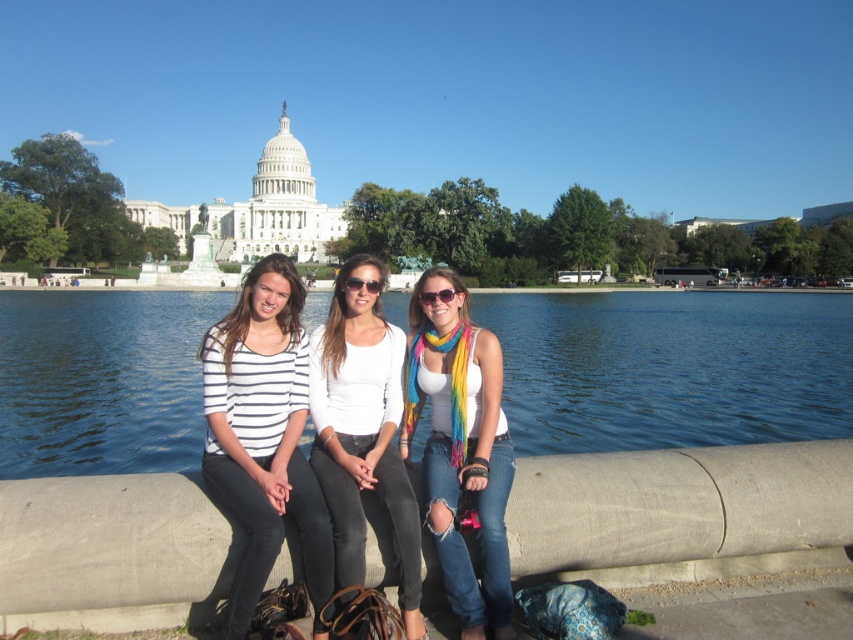
Based on the scene description and the coordinates provided, what is located at the point labeled as point (x=671, y=369)?

The point (x=671, y=369) indicates blue water at center.